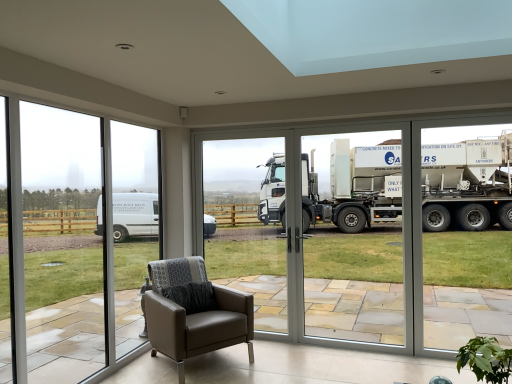
Question: Would you say transparent glass door at center is a long distance from transparent glass window at left?

Choices:
 (A) no
 (B) yes

Answer: (B)

Question: Considering the relative sizes of transparent glass door at center and transparent glass window at left in the image provided, is transparent glass door at center smaller than transparent glass window at left?

Choices:
 (A) no
 (B) yes

Answer: (B)

Question: Can you confirm if transparent glass door at center is wider than transparent glass window at left?

Choices:
 (A) no
 (B) yes

Answer: (B)

Question: Can you confirm if transparent glass door at center is bigger than transparent glass window at left?

Choices:
 (A) no
 (B) yes

Answer: (A)

Question: From the image's perspective, would you say transparent glass door at center is shown under transparent glass window at left?

Choices:
 (A) yes
 (B) no

Answer: (A)

Question: Is green leafy plant at lower right bigger or smaller than brown leather armchair at lower center?

Choices:
 (A) small
 (B) big

Answer: (A)

Question: Is green leafy plant at lower right taller or shorter than brown leather armchair at lower center?

Choices:
 (A) tall
 (B) short

Answer: (B)

Question: Which is correct: green leafy plant at lower right is inside brown leather armchair at lower center, or outside of it?

Choices:
 (A) outside
 (B) inside

Answer: (A)

Question: Looking at their shapes, would you say green leafy plant at lower right is wider or thinner than brown leather armchair at lower center?

Choices:
 (A) thin
 (B) wide

Answer: (A)

Question: Considering the positions of green leafy plant at lower right and transparent glass door at center in the image, is green leafy plant at lower right bigger or smaller than transparent glass door at center?

Choices:
 (A) big
 (B) small

Answer: (B)

Question: Considering the positions of green leafy plant at lower right and transparent glass door at center in the image, is green leafy plant at lower right taller or shorter than transparent glass door at center?

Choices:
 (A) short
 (B) tall

Answer: (A)

Question: In the image, is green leafy plant at lower right on the left side or the right side of transparent glass door at center?

Choices:
 (A) left
 (B) right

Answer: (B)

Question: Looking at their shapes, would you say green leafy plant at lower right is wider or thinner than transparent glass door at center?

Choices:
 (A) thin
 (B) wide

Answer: (B)

Question: From a real-world perspective, relative to transparent glass door at center, is white glossy truck at center vertically above or below?

Choices:
 (A) below
 (B) above

Answer: (A)

Question: From their relative heights in the image, would you say white glossy truck at center is taller or shorter than transparent glass door at center?

Choices:
 (A) tall
 (B) short

Answer: (A)